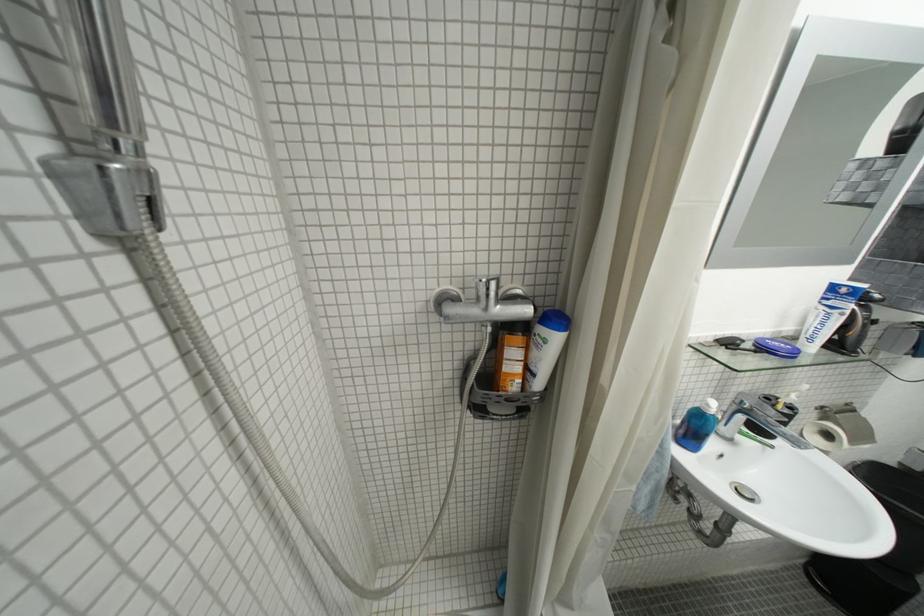
Find where to lift the chrome faucet handle. Please return your answer as a coordinate pair (x, y).

(773, 415)